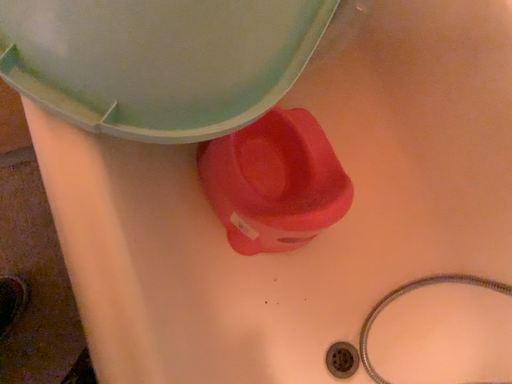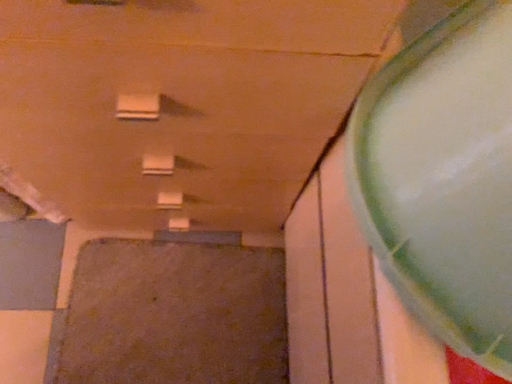
Question: How did the camera likely rotate when shooting the video?

Choices:
 (A) rotated downward
 (B) rotated upward

Answer: (B)